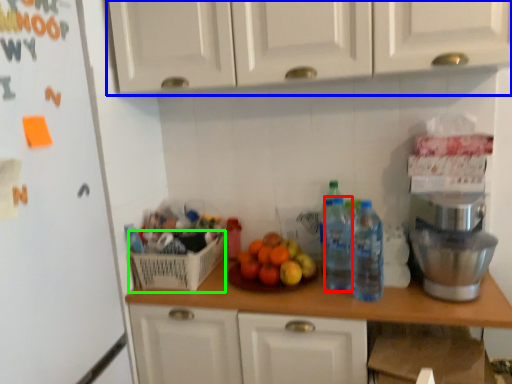
Question: Which object is the farthest from bottle (highlighted by a red box)? Choose among these: cabinetry (highlighted by a blue box) or basket (highlighted by a green box).

Choices:
 (A) cabinetry
 (B) basket

Answer: (A)